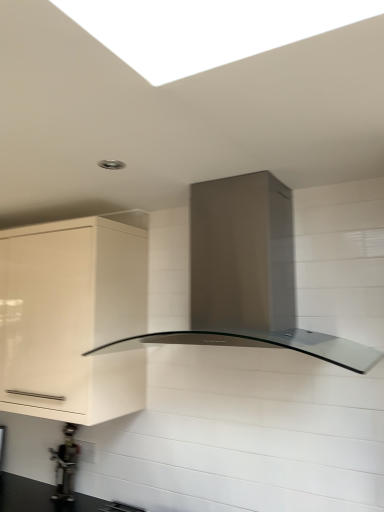
Question: In the image, is satin metallic range hood at center positioned in front of or behind white glossy cabinet at left?

Choices:
 (A) front
 (B) behind

Answer: (A)

Question: From a real-world perspective, is satin metallic range hood at center above or below white glossy cabinet at left?

Choices:
 (A) below
 (B) above

Answer: (B)

Question: Estimate the real-world distances between objects in this image. Which object is farther from the white glossy cabinet at left?

Choices:
 (A) metallic gray water heater at lower left
 (B) satin metallic range hood at center

Answer: (A)

Question: Based on their relative distances, which object is farther from the satin metallic range hood at center?

Choices:
 (A) white glossy cabinet at left
 (B) metallic gray water heater at lower left

Answer: (B)